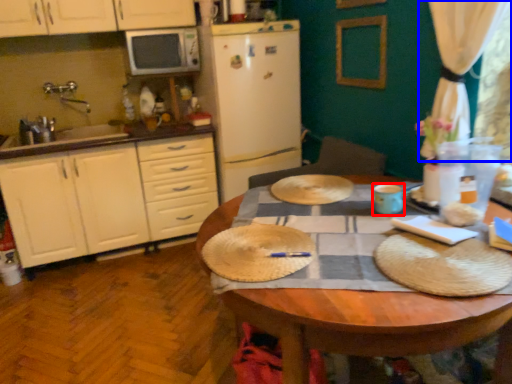
Question: Which object is further to the camera taking this photo, coffee cup (highlighted by a red box) or curtain (highlighted by a blue box)?

Choices:
 (A) coffee cup
 (B) curtain

Answer: (A)